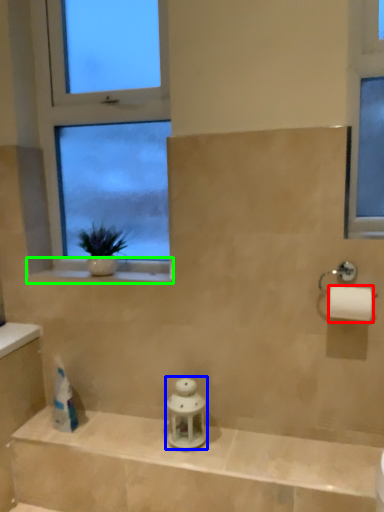
Question: Estimate the real-world distances between objects in this image. Which object is closer to toilet paper (highlighted by a red box), toiletry (highlighted by a blue box) or window sill (highlighted by a green box)?

Choices:
 (A) toiletry
 (B) window sill

Answer: (A)